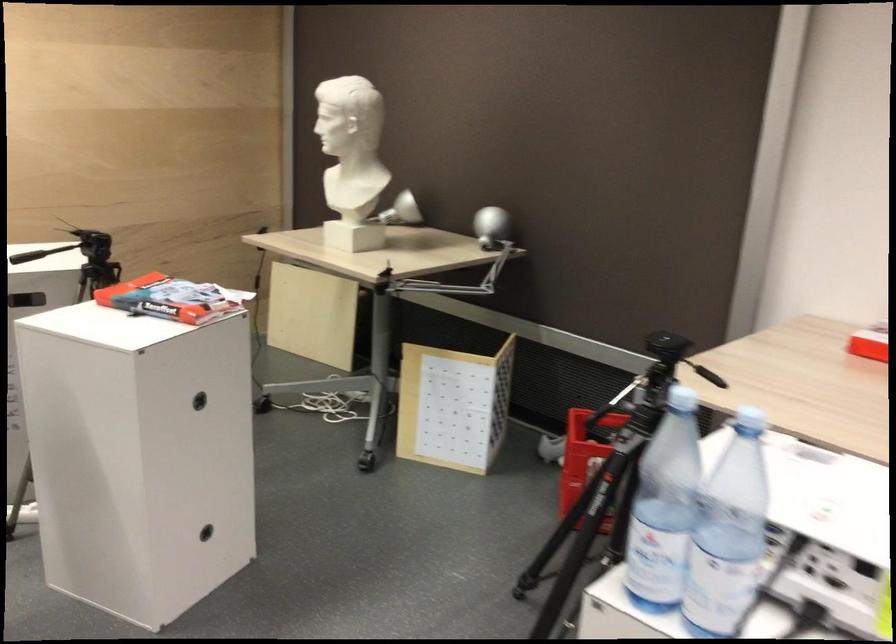
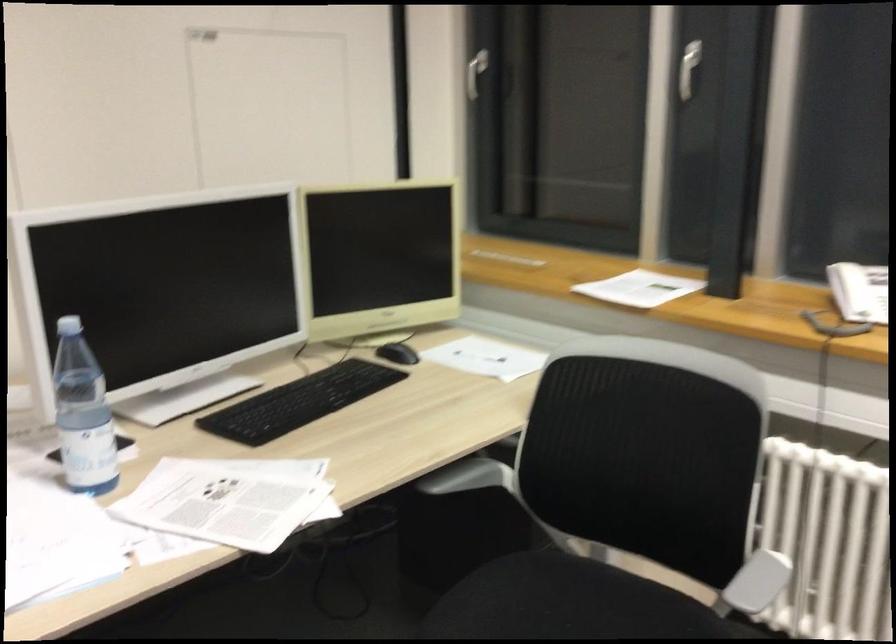
The first image is from the beginning of the video and the second image is from the end. How did the camera likely rotate when shooting the video?

The rotation direction of the camera is right-down.